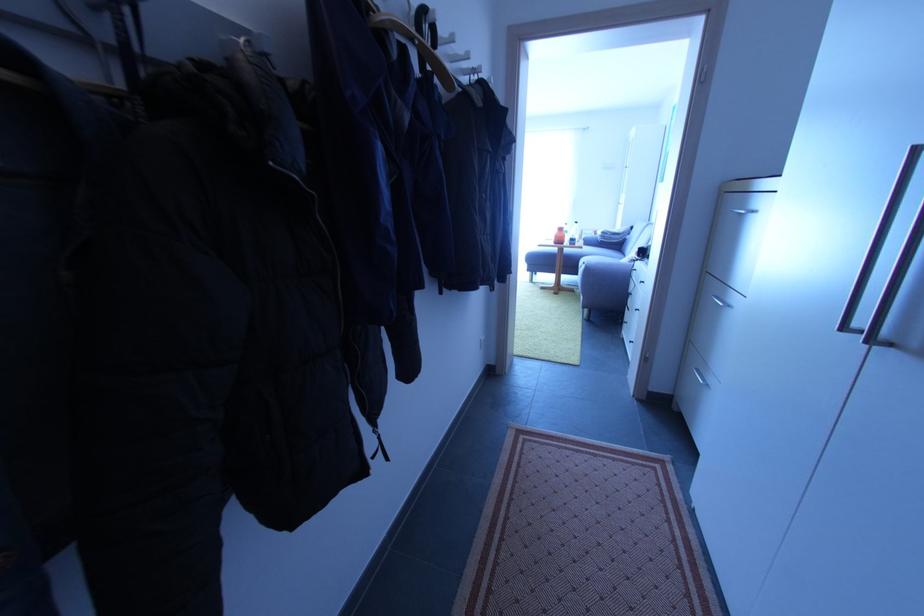
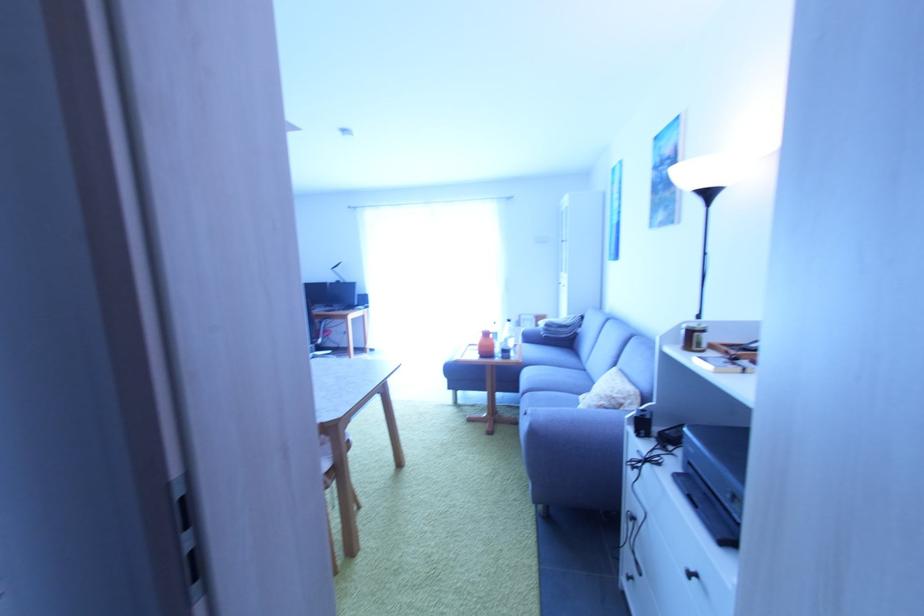
The images are taken continuously from a first-person perspective. In which direction are you moving?

The movement direction of the cameraman is right, forward.